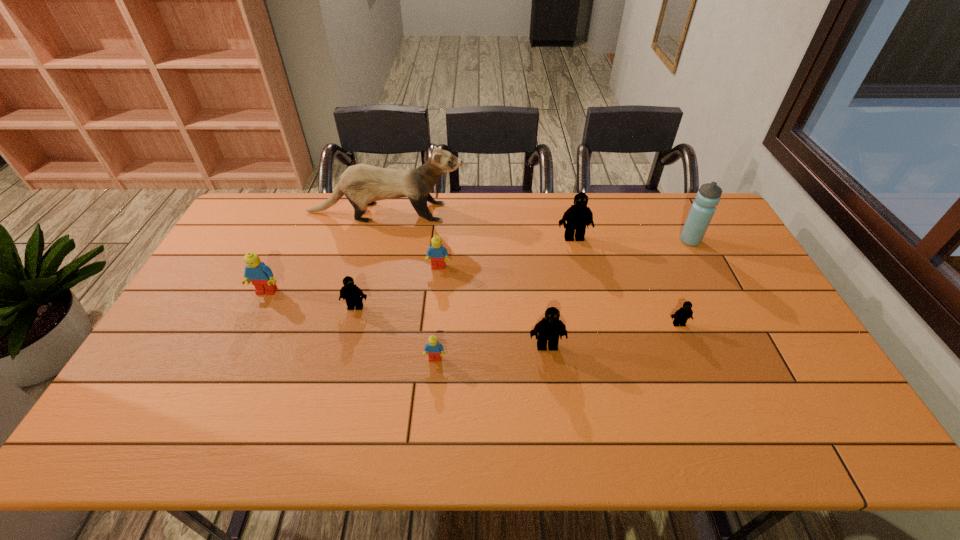
Identify the location of blank area located 0.110m on the face of the leftmost Lego. The image size is (960, 540). (251, 326).

You are a GUI agent. You are given a task and a screenshot of the screen. Output one action in this format:
    pyautogui.click(x=<x>, y=<y>)
    Task: Click on the free spot located 0.250m on the face of the nearest black Lego
    Image resolution: width=960 pixels, height=540 pixels.
    Given the screenshot: What is the action you would take?
    pyautogui.click(x=560, y=442)

Find the location of a particular element. free space located 0.260m on the face of the leftmost black Lego is located at coordinates (333, 390).

Where is `vacant space located 0.130m on the face of the sixth nearest Lego`? This screenshot has height=540, width=960. vacant space located 0.130m on the face of the sixth nearest Lego is located at coordinates (435, 302).

Where is `free region located 0.110m on the face of the seventh farthest object`? free region located 0.110m on the face of the seventh farthest object is located at coordinates (693, 360).

At what (x,y) coordinates should I click in order to perform the action: click on free space located 0.200m on the face of the smallest blue Lego. Please return your answer as a coordinate pair (x, y). The image size is (960, 540). Looking at the image, I should click on click(x=428, y=437).

Where is `object located at the far edge`? The width and height of the screenshot is (960, 540). object located at the far edge is located at coordinates (362, 184).

Locate an element on the screen. object at the right edge is located at coordinates (702, 210).

This screenshot has height=540, width=960. I want to click on blank space at the far edge of the desktop, so click(439, 198).

This screenshot has height=540, width=960. Identify the location of vacant region at the near edge of the desktop. (527, 434).